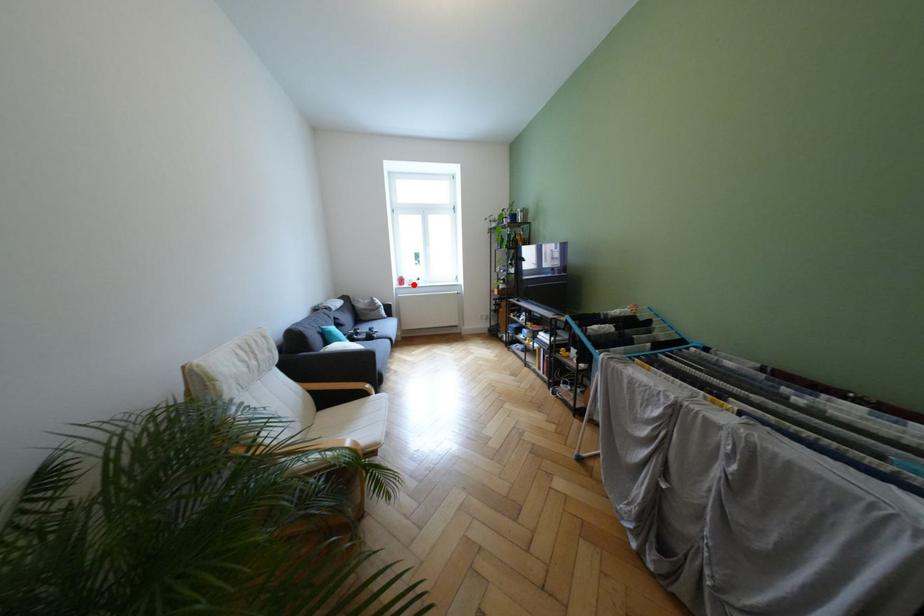
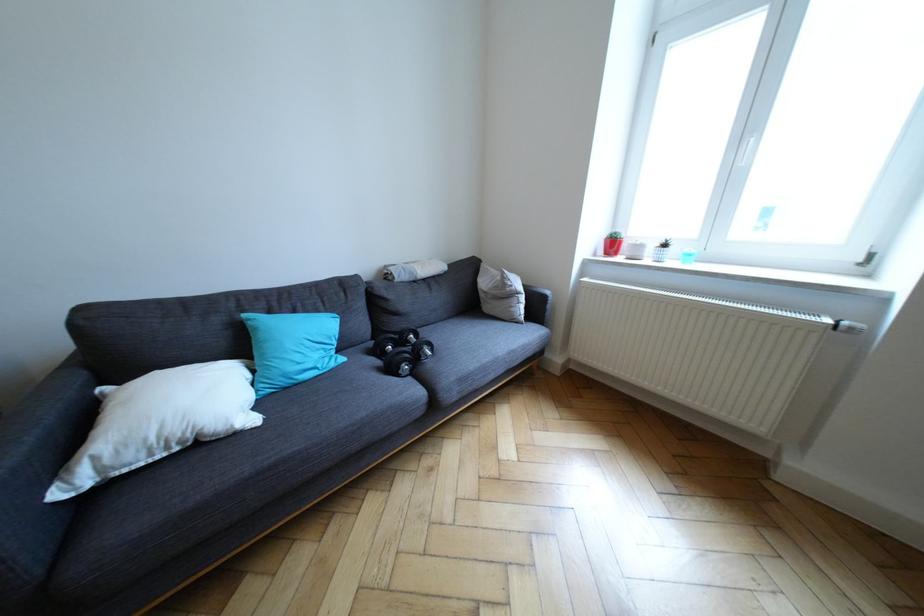
Where in the second image is the point corresponding to the highlighted location from the first image?

(626, 254)